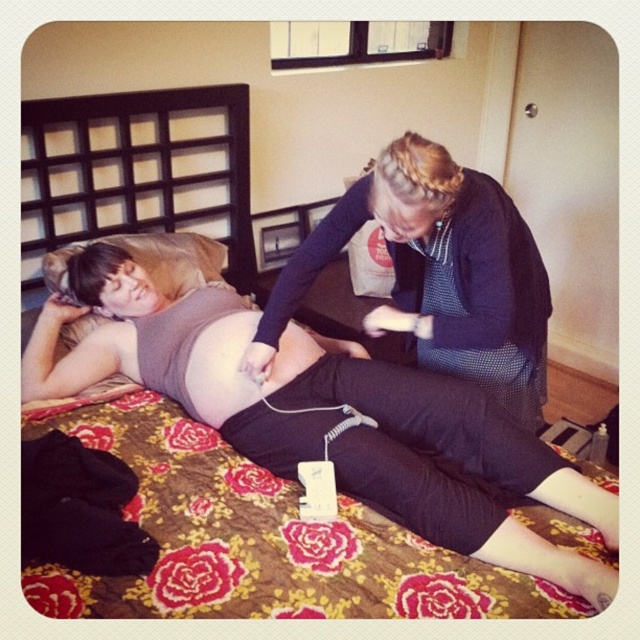
Question: Which point is farther to the camera?

Choices:
 (A) (449, 177)
 (B) (244, 314)

Answer: (B)

Question: Which point is farther to the camera?

Choices:
 (A) matte skin at center
 (B) dark blue textured sweater at upper center
 (C) brown fabric pillow at upper left

Answer: (C)

Question: Which object is positioned farthest from the brown fabric pillow at upper left?

Choices:
 (A) dark blue textured sweater at upper center
 (B) matte skin at center

Answer: (A)

Question: Can you confirm if dark blue textured sweater at upper center is positioned below matte skin at center?

Choices:
 (A) yes
 (B) no

Answer: (B)

Question: Observing the image, what is the correct spatial positioning of dark blue textured sweater at upper center in reference to brown fabric pillow at upper left?

Choices:
 (A) left
 (B) right

Answer: (B)

Question: Does dark blue textured sweater at upper center have a smaller size compared to brown fabric pillow at upper left?

Choices:
 (A) yes
 (B) no

Answer: (B)